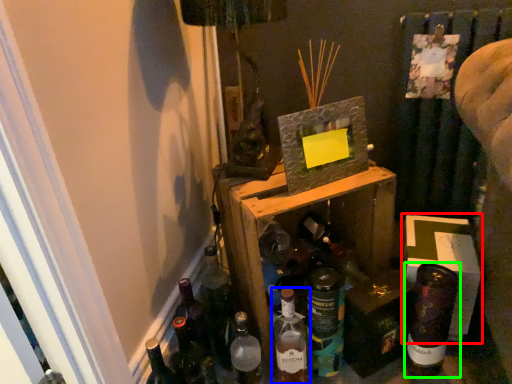
Question: Estimate the real-world distances between objects in this image. Which object is farther from cardboard box (highlighted by a red box), bottle (highlighted by a blue box) or bottle (highlighted by a green box)?

Choices:
 (A) bottle
 (B) bottle

Answer: (A)